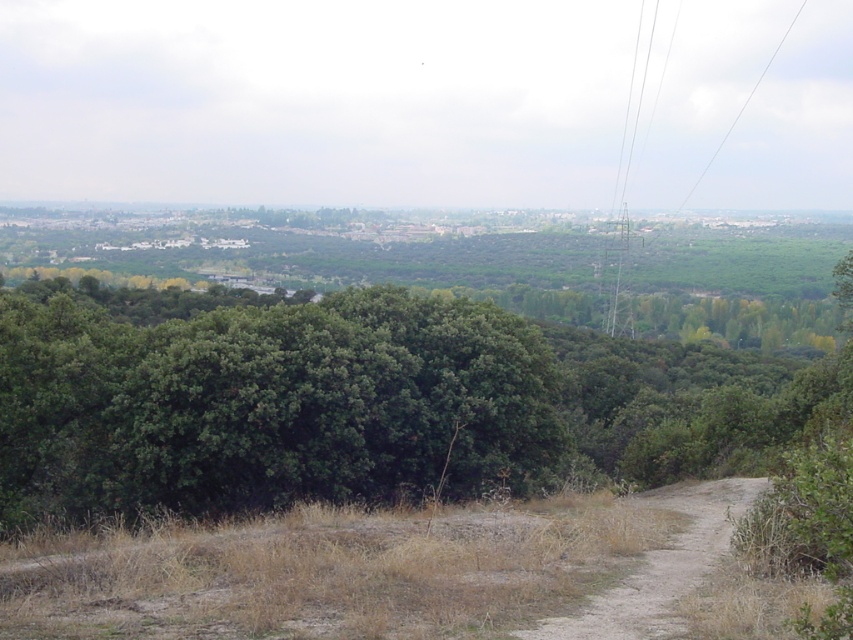
Question: Considering the relative positions of green leafy tree at center and dirt path at lower right in the image provided, where is green leafy tree at center located with respect to dirt path at lower right?

Choices:
 (A) left
 (B) right

Answer: (B)

Question: Does green leafy tree at center come behind dirt path at lower right?

Choices:
 (A) no
 (B) yes

Answer: (B)

Question: Which of these objects is positioned farthest from the green leafy tree at center?

Choices:
 (A) dirt path at lower right
 (B) metallic wire at right

Answer: (B)

Question: Which object is closer to the camera taking this photo?

Choices:
 (A) metallic wire at right
 (B) dirt path at lower right

Answer: (B)

Question: Observing the image, what is the correct spatial positioning of dirt path at lower right in reference to metallic wire at right?

Choices:
 (A) right
 (B) left

Answer: (B)

Question: Considering the real-world distances, which object is farthest from the dirt path at lower right?

Choices:
 (A) green leafy tree at center
 (B) metallic wire at right

Answer: (B)